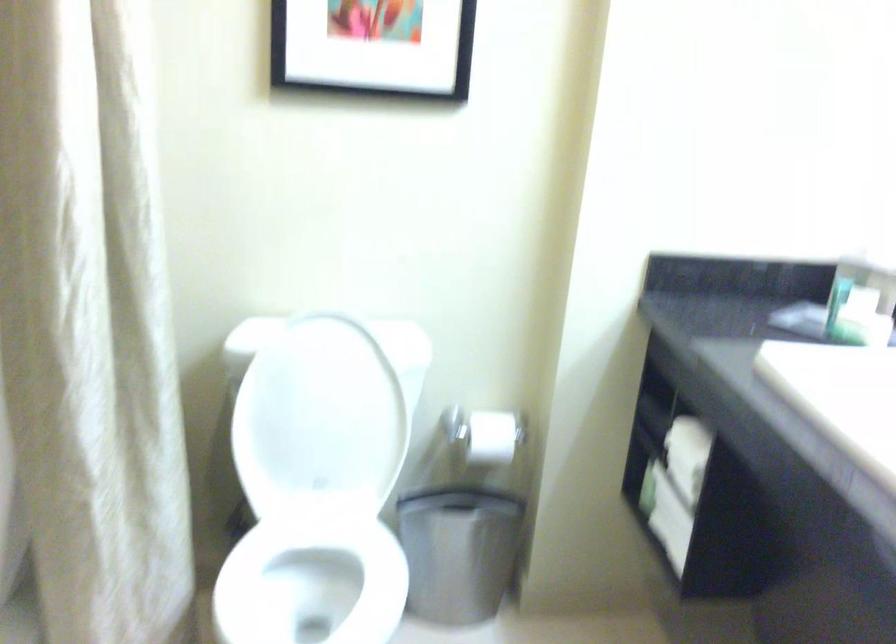
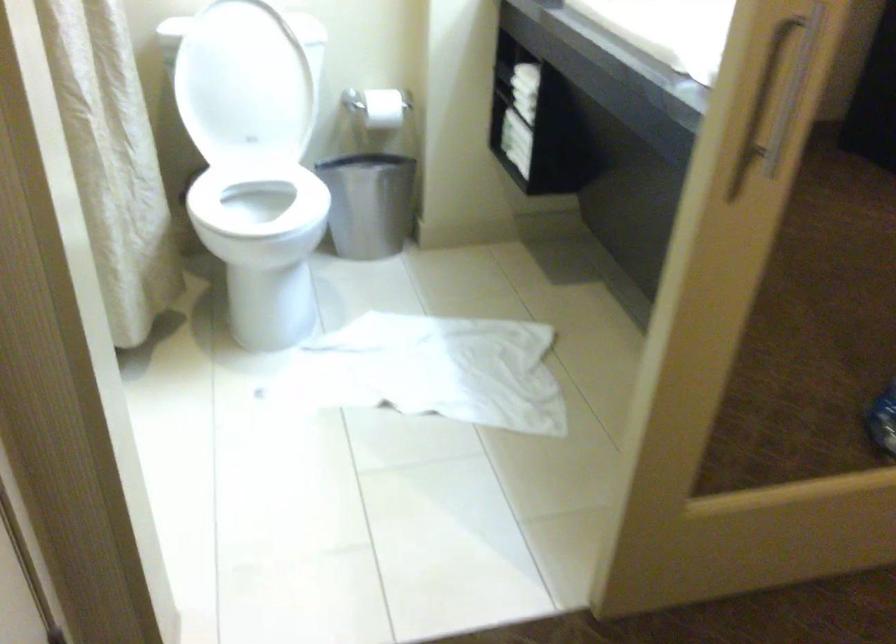
The point at (459, 559) is marked in the first image. Where is the corresponding point in the second image?

(367, 204)